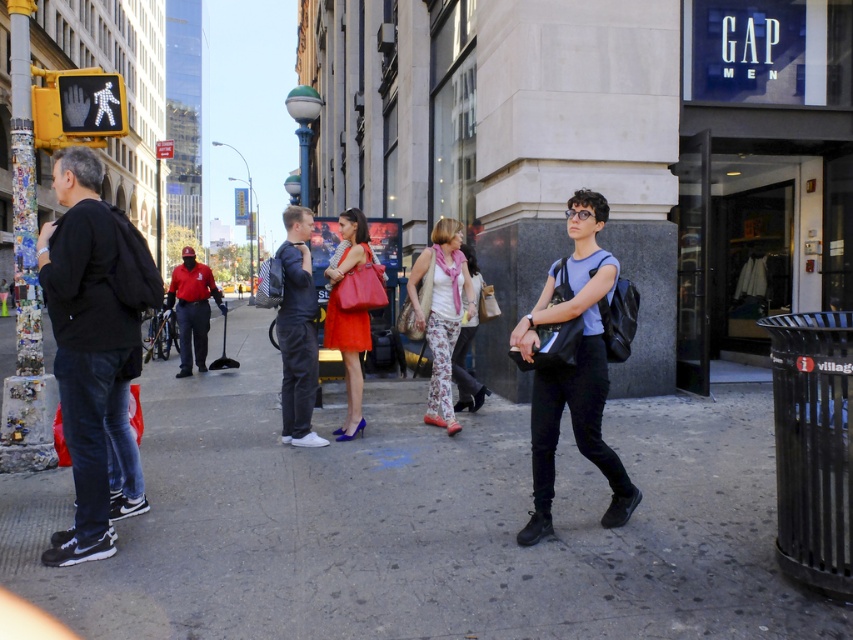
You are standing on the concrete sidewalk at center and want to reach the floral pants at center. Given that the distance between them is 5.43 feet, can you estimate how many steps it would take if each step covers approximately 2.5 feet?

The distance between the concrete sidewalk at center and the floral pants at center is 5.43 feet. Since each step covers about 2.5 feet, dividing 5.43 by 2.5 gives approximately 2.17 steps. Therefore, it would take roughly 2 to 3 steps to cover the distance.

You are a photographer standing in the middle of the urban street scene. You want to take a photo that includes both the red uniform at center and the floral leggings at center. Given that your camera has a maximum focus range of 5 meters, will you be able to capture both subjects in sharp focus?

The red uniform at center and floral leggings at center are 6.24 meters apart from each other. Since the camera can only focus within 5 meters, the distance between them exceeds the maximum focus range. Therefore, you cannot capture both subjects in sharp focus.

You are a delivery person trying to navigate through the urban street scene. You see the concrete sidewalk at center and the red uniform at center. Which one is located lower in the image?

The concrete sidewalk at center is located below the red uniform at center, so the concrete sidewalk at center is lower in the image.